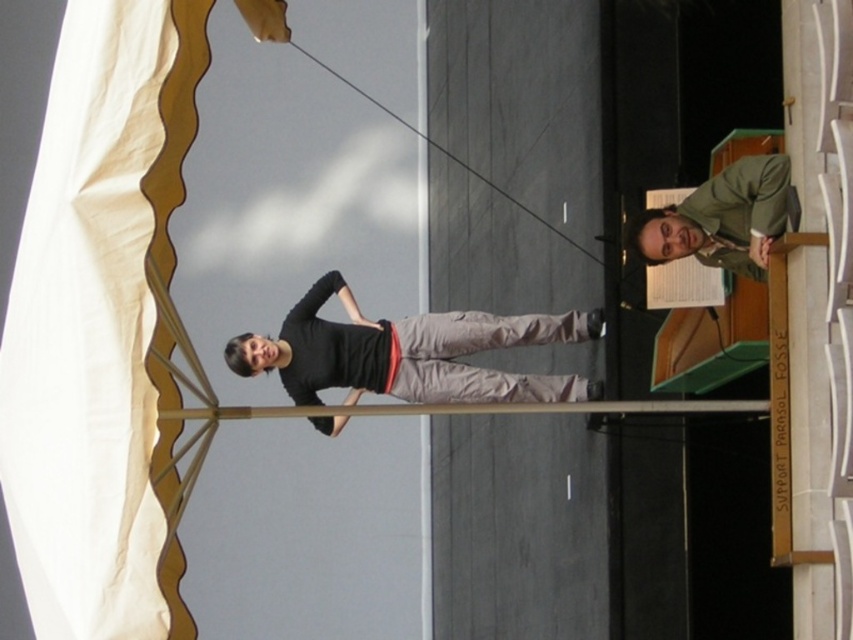
Between black matte shirt at center and green matte jacket at upper right, which one is positioned higher?

green matte jacket at upper right is higher up.

What do you see at coordinates (408, 353) in the screenshot?
I see `black matte shirt at center` at bounding box center [408, 353].

The width and height of the screenshot is (853, 640). Find the location of `black matte shirt at center`. black matte shirt at center is located at coordinates (408, 353).

The image size is (853, 640). I want to click on black matte shirt at center, so click(x=408, y=353).